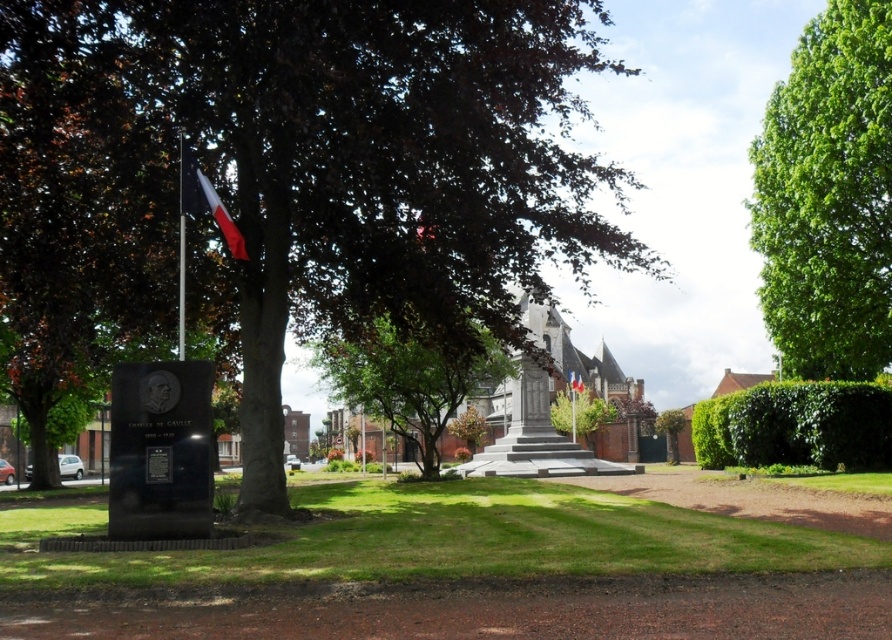
Question: From the image, what is the correct spatial relationship of green leafy hedge at right in relation to metallic flag pole at upper center?

Choices:
 (A) left
 (B) right

Answer: (B)

Question: Among these points, which one is nearest to the camera?

Choices:
 (A) (576, 372)
 (B) (178, 180)

Answer: (B)

Question: Does dark green leafy tree at center come behind metallic flag pole at upper center?

Choices:
 (A) yes
 (B) no

Answer: (B)

Question: Which object is farther from the camera taking this photo?

Choices:
 (A) polished red flag at left
 (B) dark green leafy tree at center
 (C) green leafy tree at upper right

Answer: (C)

Question: Which point is closer to the camera?

Choices:
 (A) metallic flag pole at upper center
 (B) polished red flag at left

Answer: (A)

Question: Is green leafy tree at center further to camera compared to metallic flag pole at upper center?

Choices:
 (A) no
 (B) yes

Answer: (B)